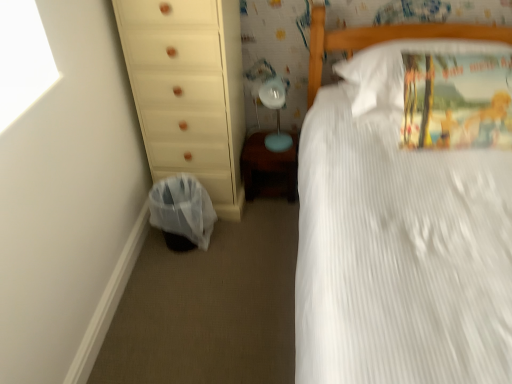
Where is `matte blue table lamp at center`? The width and height of the screenshot is (512, 384). matte blue table lamp at center is located at coordinates (276, 114).

Describe the element at coordinates (395, 73) in the screenshot. I see `white cotton pillow at upper right` at that location.

Describe the element at coordinates (188, 90) in the screenshot. The width and height of the screenshot is (512, 384). I see `white wood chest of drawers at left` at that location.

You are a GUI agent. You are given a task and a screenshot of the screen. Output one action in this format:
    pyautogui.click(x=<x>, y=<y>)
    Task: Click on the matte blue table lamp at center
    The image size is (512, 384).
    Given the screenshot: What is the action you would take?
    pyautogui.click(x=276, y=114)

What's the angular difference between matte blue table lamp at center and wooden changing table at lower center's facing directions?

They differ by 0.00726 degrees in their facing directions.

Would you say matte blue table lamp at center is inside or outside wooden changing table at lower center?

matte blue table lamp at center is not enclosed by wooden changing table at lower center.

Is point (277, 106) closer to viewer compared to point (263, 141)?

Yes, it is.

Can you confirm if matte blue table lamp at center is smaller than wooden changing table at lower center?

Correct, matte blue table lamp at center occupies less space than wooden changing table at lower center.

Would you consider white cotton pillow at upper right to be distant from plastic bag at lower left?

They are positioned close to each other.

From the image's perspective, which object appears higher, white cotton pillow at upper right or plastic bag at lower left?

white cotton pillow at upper right.

Is white cotton pillow at upper right at the left side of plastic bag at lower left?

No.

Is white cotton pillow at upper right not within plastic bag at lower left?

Yes, white cotton pillow at upper right is located beyond the bounds of plastic bag at lower left.

How different are the orientations of matte blue table lamp at center and white wood chest of drawers at left in degrees?

0.0358 degrees separate the facing orientations of matte blue table lamp at center and white wood chest of drawers at left.

From the image's perspective, which one is positioned lower, matte blue table lamp at center or white wood chest of drawers at left?

matte blue table lamp at center.

Who is shorter, matte blue table lamp at center or white wood chest of drawers at left?

matte blue table lamp at center.

Does plastic bag at lower left lie in front of white textured bed at right?

No, it is not.

Does point (161, 222) come farther from viewer compared to point (314, 331)?

Yes.

The width and height of the screenshot is (512, 384). I want to click on laundry basket below the white textured bed at right (from the image's perspective), so click(x=183, y=209).

Would you say plastic bag at lower left is inside or outside white textured bed at right?

plastic bag at lower left is located beyond the bounds of white textured bed at right.

Is point (382, 111) less distant than point (264, 82)?

Yes.

Does white cotton pillow at upper right appear on the right side of matte blue table lamp at center?

Correct, you'll find white cotton pillow at upper right to the right of matte blue table lamp at center.

Which object is more forward, white cotton pillow at upper right or matte blue table lamp at center?

white cotton pillow at upper right is in front.

From a real-world perspective, is white cotton pillow at upper right on matte blue table lamp at center?

Indeed, from a real-world perspective, white cotton pillow at upper right stands above matte blue table lamp at center.

Is white cotton pillow at upper right located within wooden changing table at lower center?

No, white cotton pillow at upper right is not inside wooden changing table at lower center.

Is wooden changing table at lower center at the right side of white cotton pillow at upper right?

In fact, wooden changing table at lower center is to the left of white cotton pillow at upper right.

From a real-world perspective, which object rests below the other?

wooden changing table at lower center is physically lower.

Is wooden changing table at lower center far away from white cotton pillow at upper right?

Actually, wooden changing table at lower center and white cotton pillow at upper right are a little close together.

Which object is positioned more to the right, white wood chest of drawers at left or white cotton pillow at upper right?

white cotton pillow at upper right is more to the right.

Between white wood chest of drawers at left and white cotton pillow at upper right, which one has more height?

Standing taller between the two is white wood chest of drawers at left.

From a real-world perspective, is white wood chest of drawers at left positioned above or below white cotton pillow at upper right?

white wood chest of drawers at left is situated lower than white cotton pillow at upper right in the real world.

Which is further, (208, 177) or (426, 43)?

The point (208, 177) is farther.

Identify the location of changing table behind the matte blue table lamp at center. This screenshot has height=384, width=512. (269, 169).

Find the location of a particular element. Image resolution: width=512 pixels, height=384 pixels. pillow above the plastic bag at lower left (from the image's perspective) is located at coordinates (395, 73).

Consider the image. Based on their spatial positions, is white wood chest of drawers at left or white cotton pillow at upper right closer to white textured bed at right?

white cotton pillow at upper right is closer to white textured bed at right.

Looking at the image, which one is located further to plastic bag at lower left, matte blue table lamp at center or white cotton pillow at upper right?

The object further to plastic bag at lower left is white cotton pillow at upper right.

Looking at this image, when comparing their distances from plastic bag at lower left, does white textured bed at right or wooden changing table at lower center seem closer?

wooden changing table at lower center is positioned closer to the anchor plastic bag at lower left.

Estimate the real-world distances between objects in this image. Which object is further from wooden changing table at lower center, plastic bag at lower left or white textured bed at right?

Among the two, white textured bed at right is located further to wooden changing table at lower center.

Looking at the image, which one is located further to wooden changing table at lower center, white cotton pillow at upper right or white wood chest of drawers at left?

white cotton pillow at upper right is positioned further to the anchor wooden changing table at lower center.

Considering their positions, is matte blue table lamp at center positioned further to wooden changing table at lower center than white cotton pillow at upper right?

white cotton pillow at upper right is further to wooden changing table at lower center.

When comparing their distances from white cotton pillow at upper right, does wooden changing table at lower center or plastic bag at lower left seem further?

Based on the image, plastic bag at lower left appears to be further to white cotton pillow at upper right.

Looking at the image, which one is located closer to plastic bag at lower left, white cotton pillow at upper right or white wood chest of drawers at left?

The object closer to plastic bag at lower left is white wood chest of drawers at left.

Where is `the chest of drawers located between plastic bag at lower left and white cotton pillow at upper right in the left-right direction`? the chest of drawers located between plastic bag at lower left and white cotton pillow at upper right in the left-right direction is located at coordinates (188, 90).

You are a GUI agent. You are given a task and a screenshot of the screen. Output one action in this format:
    pyautogui.click(x=<x>, y=<y>)
    Task: Click on the table lamp between white wood chest of drawers at left and plastic bag at lower left in the up-down direction
    This screenshot has width=512, height=384.
    Given the screenshot: What is the action you would take?
    pyautogui.click(x=276, y=114)

Locate an element on the screen. changing table located between plastic bag at lower left and white cotton pillow at upper right in the left-right direction is located at coordinates (269, 169).

Where is `laundry basket located between white wood chest of drawers at left and wooden changing table at lower center in the depth direction`? The height and width of the screenshot is (384, 512). laundry basket located between white wood chest of drawers at left and wooden changing table at lower center in the depth direction is located at coordinates (183, 209).